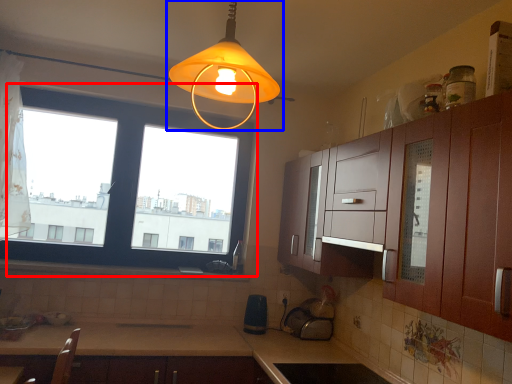
Question: Which object is further to the camera taking this photo, window (highlighted by a red box) or lamp (highlighted by a blue box)?

Choices:
 (A) window
 (B) lamp

Answer: (A)